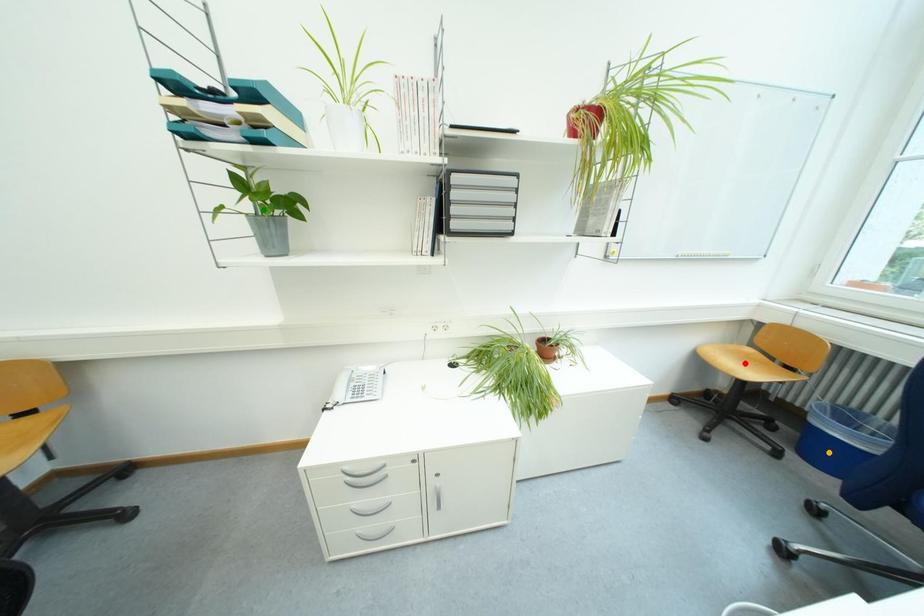
Order these from farthest to nearest:
red point | green point | orange point

red point, green point, orange point